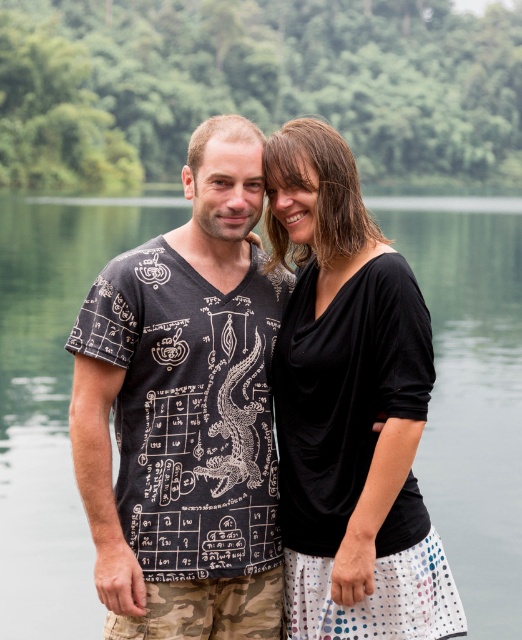
Does black printed t-shirt at center have a smaller size compared to transparent water at center?

Correct, black printed t-shirt at center occupies less space than transparent water at center.

Is point (136, 472) positioned in front of point (82, 548)?

Yes, point (136, 472) is in front of point (82, 548).

Who is more forward, (x=236, y=208) or (x=22, y=529)?

Point (x=236, y=208) is in front.

The width and height of the screenshot is (522, 640). Identify the location of black printed t-shirt at center. (185, 412).

Which of these two, transparent water at center or black matte dress at center, stands taller?

With more height is transparent water at center.

Who is positioned more to the left, transparent water at center or black matte dress at center?

From the viewer's perspective, transparent water at center appears more on the left side.

Between point (49, 504) and point (419, 627), which one is positioned behind?

The point (49, 504) is behind.

Find the location of a particular element. The image size is (522, 640). transparent water at center is located at coordinates (471, 390).

Can you confirm if black printed t-shirt at center is shorter than black matte dress at center?

Correct, black printed t-shirt at center is not as tall as black matte dress at center.

Which is in front, point (106, 502) or point (397, 372)?

Positioned in front is point (397, 372).

Which is behind, point (229, 515) or point (338, 321)?

The point (229, 515) is behind.

You are a GUI agent. You are given a task and a screenshot of the screen. Output one action in this format:
    pyautogui.click(x=<x>, y=<y>)
    Task: Click on the black printed t-shirt at center
    This screenshot has height=640, width=522.
    Given the screenshot: What is the action you would take?
    pyautogui.click(x=185, y=412)